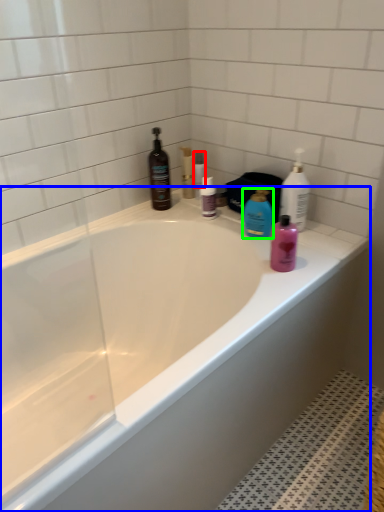
Question: Considering the real-world distances, which object is farthest from toiletry (highlighted by a red box)? bathtub (highlighted by a blue box) or cleaning product (highlighted by a green box)?

Choices:
 (A) bathtub
 (B) cleaning product

Answer: (A)